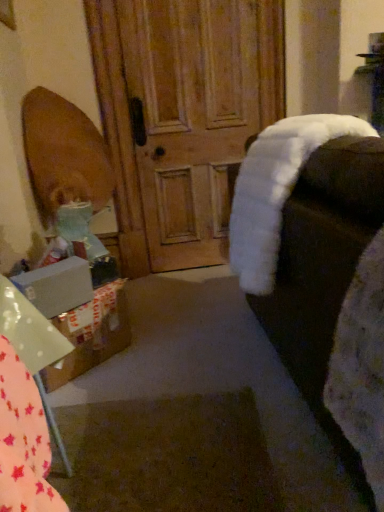
Question: Could you tell me if white matte box at lower left is facing white cardboard box at lower left?

Choices:
 (A) yes
 (B) no

Answer: (B)

Question: From a real-world perspective, is white matte box at lower left located beneath white cardboard box at lower left?

Choices:
 (A) yes
 (B) no

Answer: (B)

Question: Is white matte box at lower left not within white cardboard box at lower left?

Choices:
 (A) yes
 (B) no

Answer: (A)

Question: Considering the relative sizes of white matte box at lower left and white cardboard box at lower left in the image provided, is white matte box at lower left taller than white cardboard box at lower left?

Choices:
 (A) no
 (B) yes

Answer: (A)

Question: From the image's perspective, would you say white matte box at lower left is shown under white cardboard box at lower left?

Choices:
 (A) yes
 (B) no

Answer: (B)

Question: Is white matte box at lower left in front of or behind white fluffy rocking chair at right in the image?

Choices:
 (A) front
 (B) behind

Answer: (B)

Question: Is white matte box at lower left inside the boundaries of white fluffy rocking chair at right, or outside?

Choices:
 (A) outside
 (B) inside

Answer: (A)

Question: Looking at the image, does white matte box at lower left seem bigger or smaller compared to white fluffy rocking chair at right?

Choices:
 (A) small
 (B) big

Answer: (A)

Question: Considering the positions of white matte box at lower left and white fluffy rocking chair at right in the image, is white matte box at lower left wider or thinner than white fluffy rocking chair at right?

Choices:
 (A) wide
 (B) thin

Answer: (B)

Question: Is cardboard box at lower left bigger or smaller than white cardboard box at lower left?

Choices:
 (A) big
 (B) small

Answer: (B)

Question: Is point (3, 303) positioned closer to the camera than point (52, 320)?

Choices:
 (A) farther
 (B) closer

Answer: (B)

Question: Would you say cardboard box at lower left is to the left or to the right of white cardboard box at lower left in the picture?

Choices:
 (A) right
 (B) left

Answer: (A)

Question: From the image's perspective, is cardboard box at lower left positioned above or below white cardboard box at lower left?

Choices:
 (A) below
 (B) above

Answer: (B)

Question: Is white fluffy rocking chair at right in front of or behind white matte box at lower left in the image?

Choices:
 (A) front
 (B) behind

Answer: (A)

Question: Visually, is white fluffy rocking chair at right positioned to the left or to the right of white matte box at lower left?

Choices:
 (A) left
 (B) right

Answer: (B)